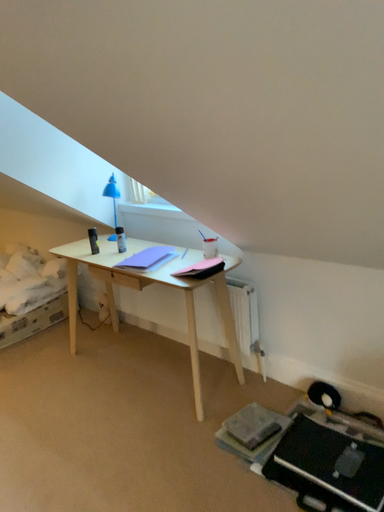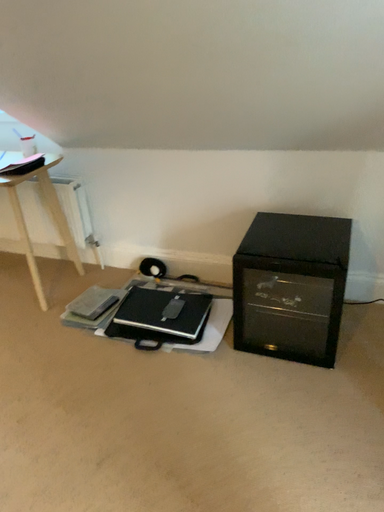
Question: Which way did the camera rotate in the video?

Choices:
 (A) rotated right
 (B) rotated left

Answer: (A)